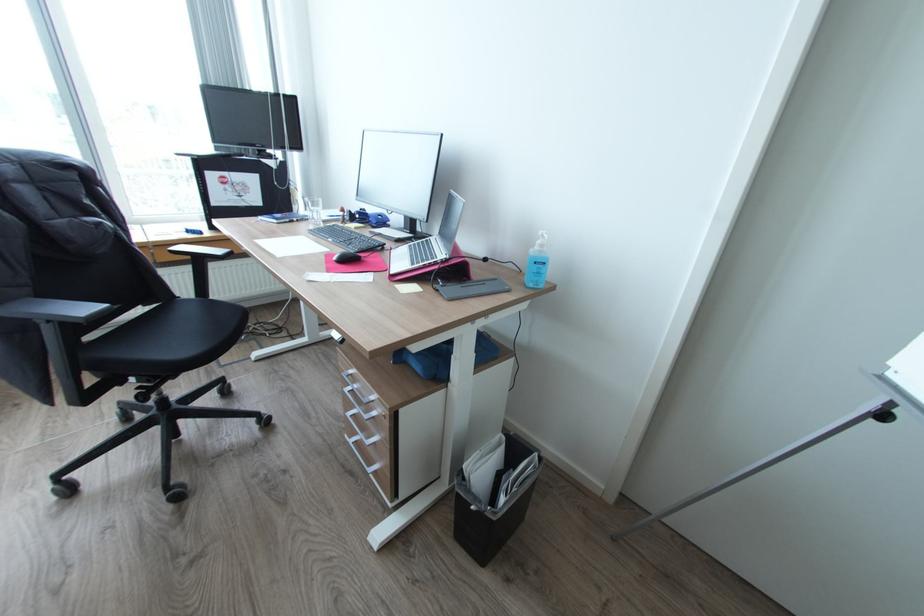
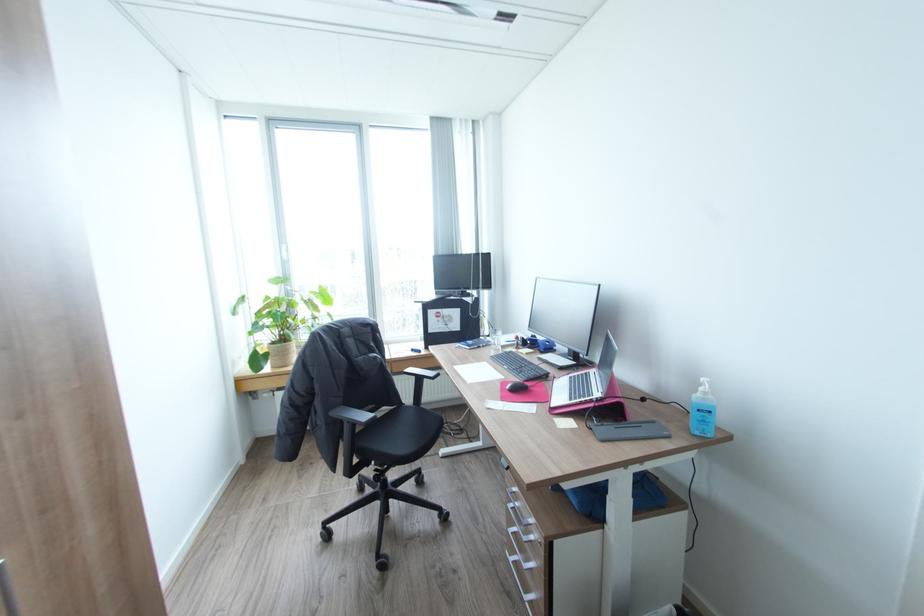
The point at [379,418] is marked in the first image. Where is the corresponding point in the second image?

(536, 541)